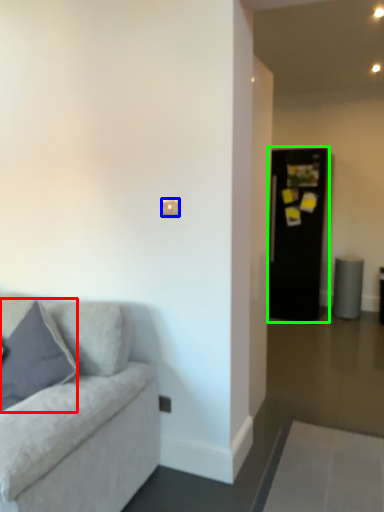
Question: Considering the real-world distances, which object is closest to pillow (highlighted by a red box)? light switch (highlighted by a blue box) or glass door (highlighted by a green box).

Choices:
 (A) light switch
 (B) glass door

Answer: (A)